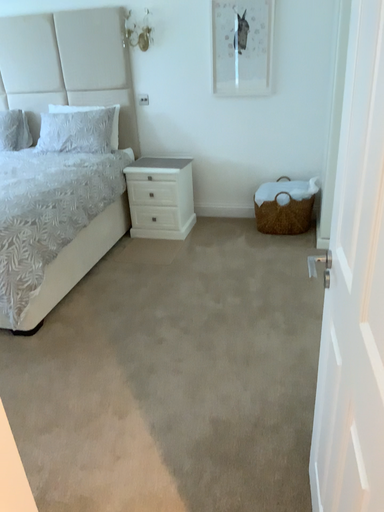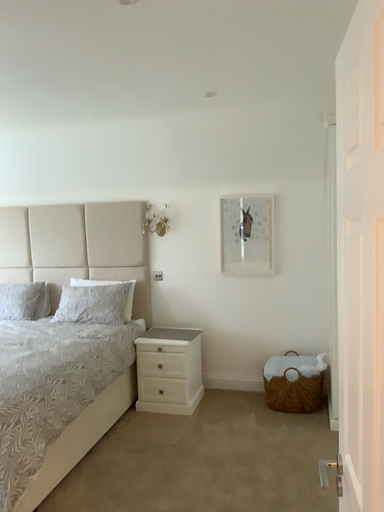
Question: How did the camera likely rotate when shooting the video?

Choices:
 (A) rotated upward
 (B) rotated downward

Answer: (A)